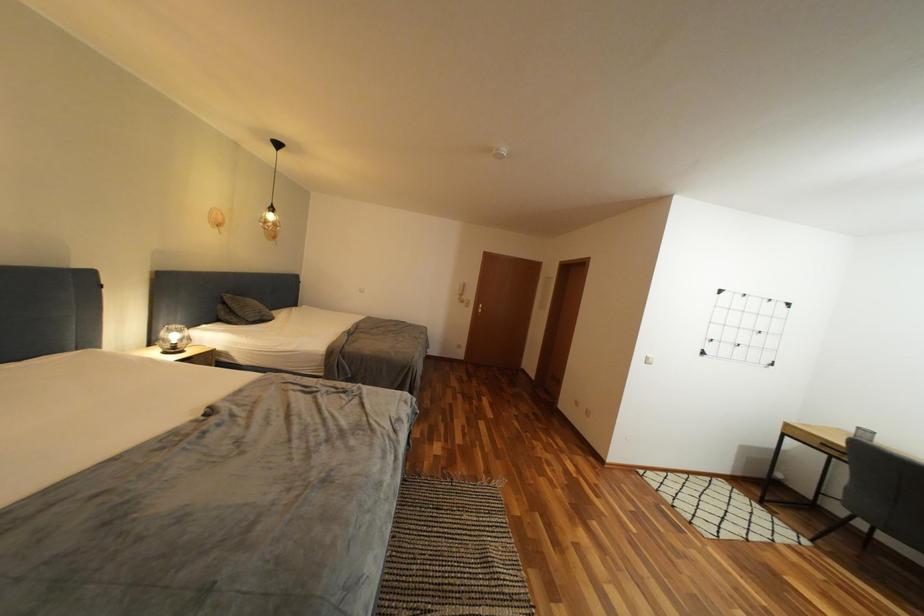
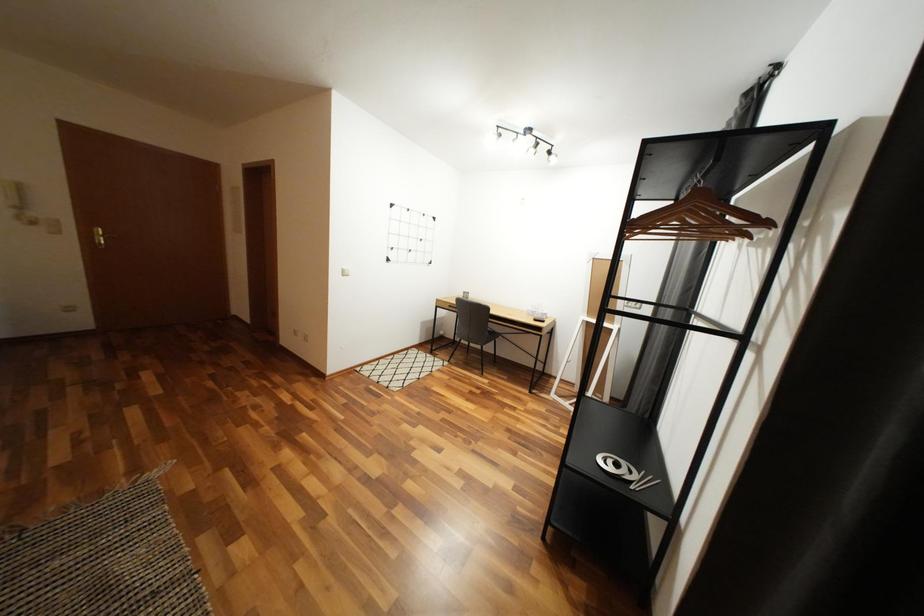
From the picture: First-person continuous shooting, in which direction is the camera rotating?

The camera's rotation is toward right-down.